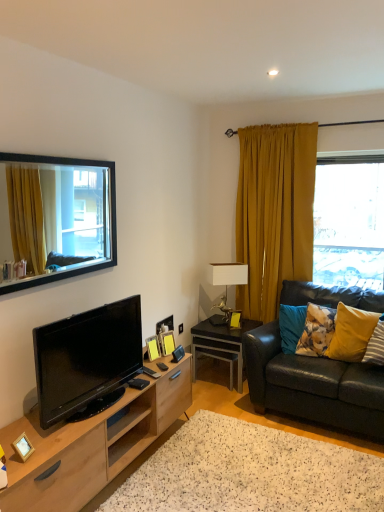
This screenshot has height=512, width=384. I want to click on spots to the right of wooden picture frame at lower left, positioned as the 4th picture frame in back-to-front order, so click(x=51, y=450).